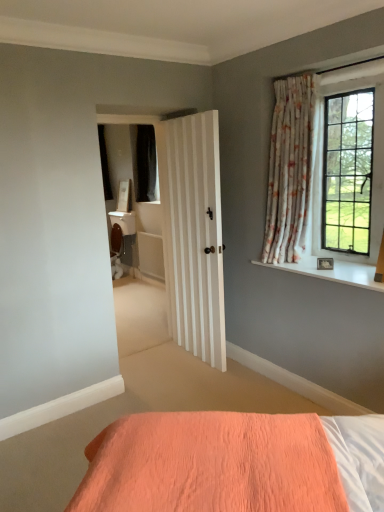
At what (x,y) coordinates should I click in order to perform the action: click on vacant space situated above floral fabric curtain at upper right (from a real-world perspective). Please return your answer as a coordinate pair (x, y). Looking at the image, I should click on (291, 73).